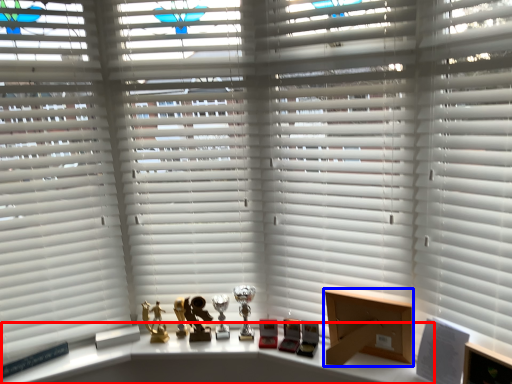
Question: Among these objects, which one is nearest to the camera, table (highlighted by a red box) or cardboard box (highlighted by a blue box)?

Choices:
 (A) table
 (B) cardboard box

Answer: (A)